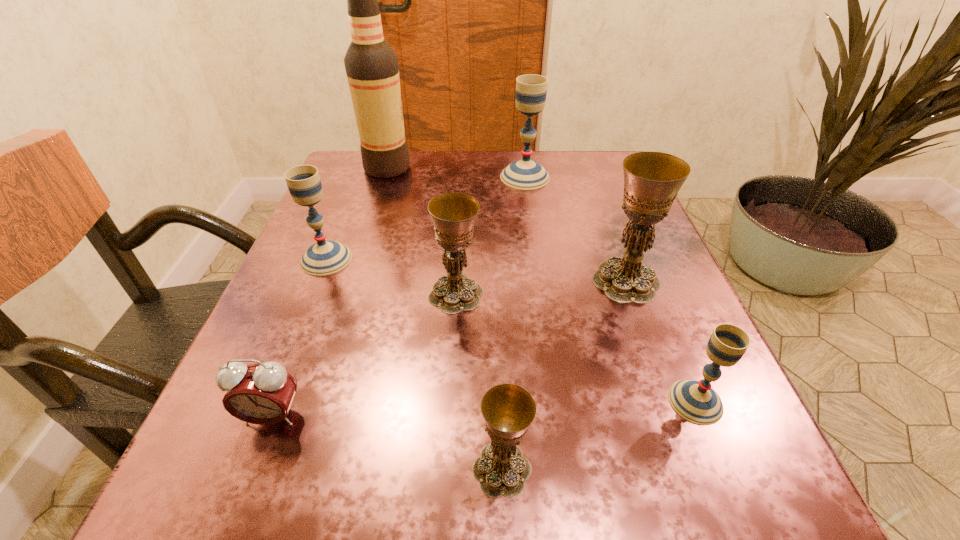
Image resolution: width=960 pixels, height=540 pixels. I want to click on free space between the leftmost chalice and the farthest chalice, so click(425, 218).

The image size is (960, 540). Identify the location of free space between the alarm clock and the nearest object. (387, 443).

Locate an element on the screen. This screenshot has width=960, height=540. vacant region between the pink alarm clock and the second smallest gray chalice is located at coordinates (300, 338).

Locate an element on the screen. vacant space that is in between the tallest object and the second smallest gray chalice is located at coordinates (357, 213).

The height and width of the screenshot is (540, 960). I want to click on vacant area that lies between the second smallest gray chalice and the rightmost gold chalice, so click(x=476, y=270).

You are a GUI agent. You are given a task and a screenshot of the screen. Output one action in this format:
    pyautogui.click(x=<x>, y=<y>)
    Task: Click on the blank region between the beige alcohol and the nearest gray chalice
    The image size is (960, 540).
    Given the screenshot: What is the action you would take?
    pyautogui.click(x=541, y=285)

You are a GUI agent. You are given a task and a screenshot of the screen. Output one action in this format:
    pyautogui.click(x=<x>, y=<y>)
    Task: Click on the seventh closest object to the leftmost gray chalice
    The image size is (960, 540).
    Given the screenshot: What is the action you would take?
    pyautogui.click(x=695, y=401)

Where is `object identified as the closest to the second biggest gold chalice`? object identified as the closest to the second biggest gold chalice is located at coordinates (325, 257).

Select which chalice appears as the third closest to the second smallest gold chalice. Please provide its 2D coordinates. Your answer should be formatted as a tuple, i.e. [(x, y)], where the tuple contains the x and y coordinates of a point satisfying the conditions above.

[(508, 410)]

Select which chalice appears as the second closest to the beige alcohol. Please provide its 2D coordinates. Your answer should be formatted as a tuple, i.e. [(x, y)], where the tuple contains the x and y coordinates of a point satisfying the conditions above.

[(325, 257)]